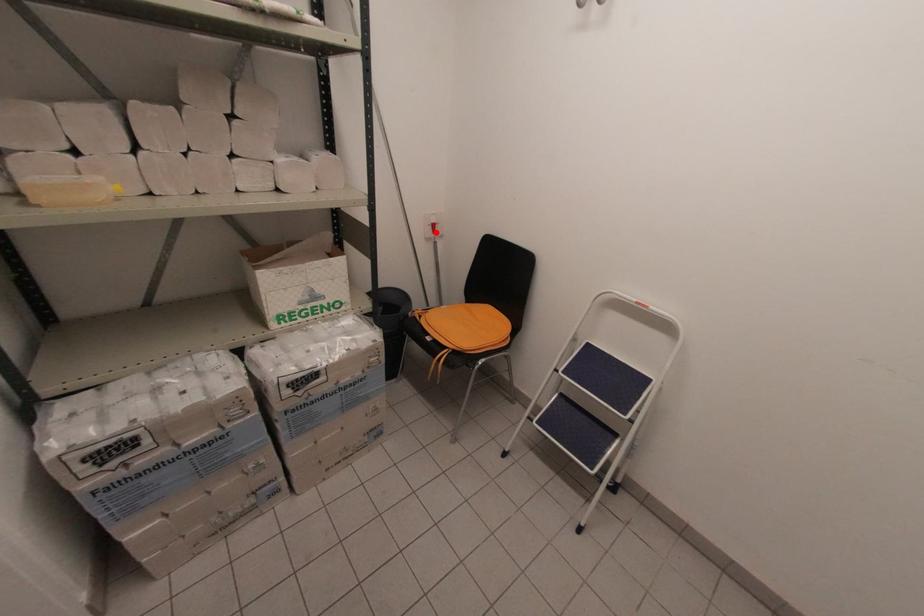
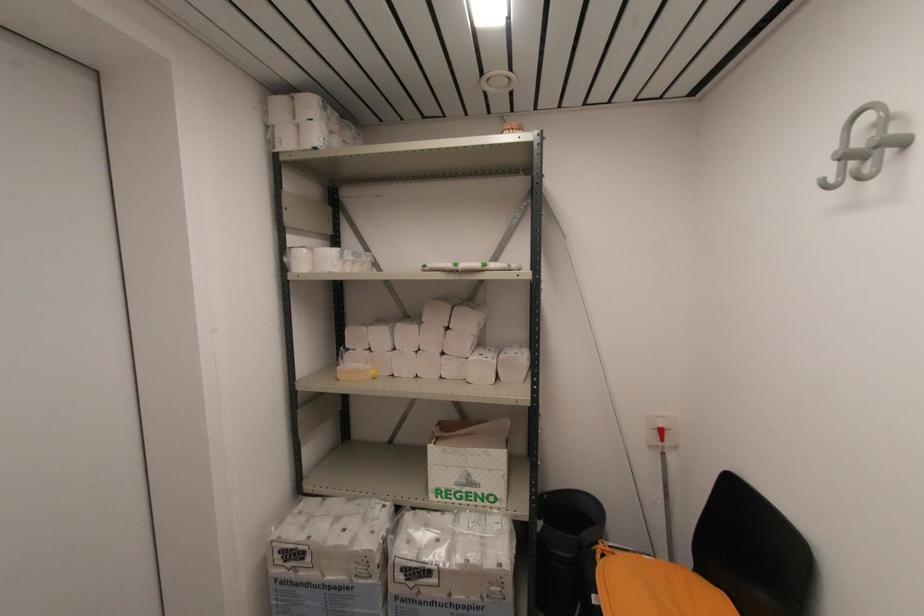
Where in the second image is the point corresponding to the highlighted location from the first image?

(663, 439)